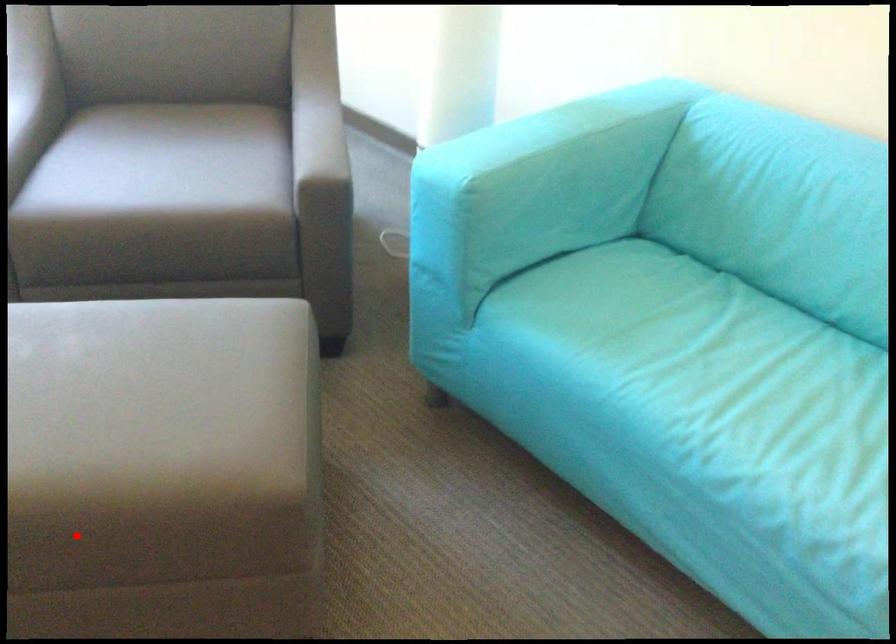
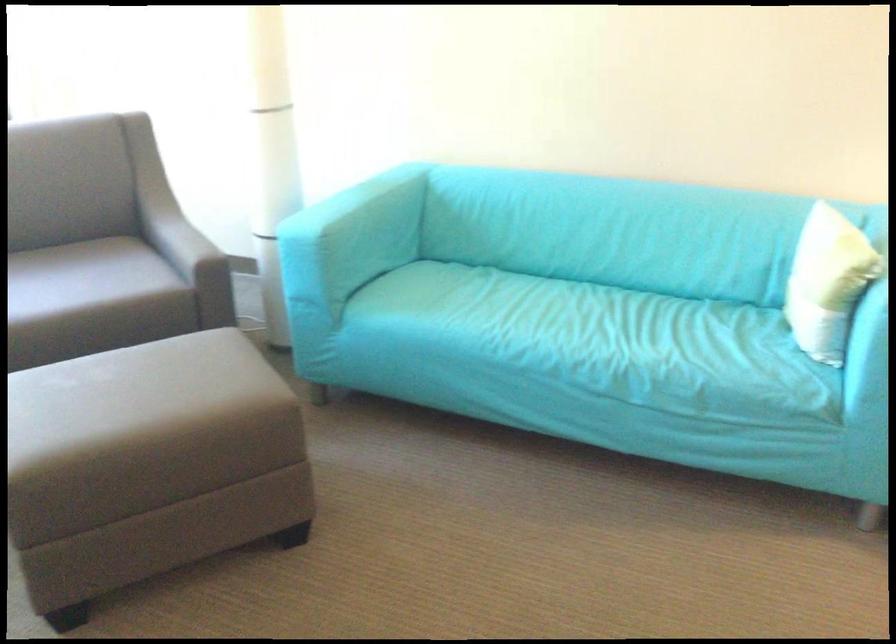
Where in the second image is the point corresponding to the highlighted location from the first image?

(149, 464)